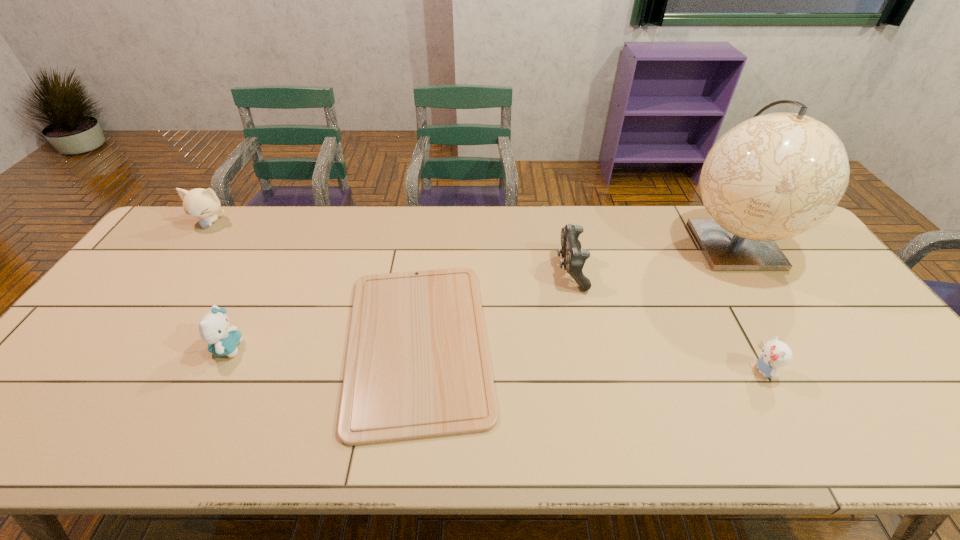
Locate an element on the screen. The image size is (960, 540). the tallest object is located at coordinates (772, 177).

Find the location of a particular element. The height and width of the screenshot is (540, 960). the leftmost kitten is located at coordinates (200, 203).

This screenshot has width=960, height=540. I want to click on the leftmost object, so click(x=200, y=203).

Locate an element on the screen. The height and width of the screenshot is (540, 960). control is located at coordinates (574, 257).

Identify the location of the second object from left to right. (214, 329).

At what (x,y) coordinates should I click in order to perform the action: click on the rightmost kitten. Please return your answer as a coordinate pair (x, y). The image size is (960, 540). Looking at the image, I should click on (775, 353).

Locate an element on the screen. The width and height of the screenshot is (960, 540). the shortest kitten is located at coordinates (775, 353).

The image size is (960, 540). What are the coordinates of `the third object from left to right` in the screenshot? It's located at (417, 366).

This screenshot has height=540, width=960. Identify the location of chopping board. (417, 366).

I want to click on free space located 0.330m on the surface of the tallest object showing Europe and Africa, so click(x=823, y=383).